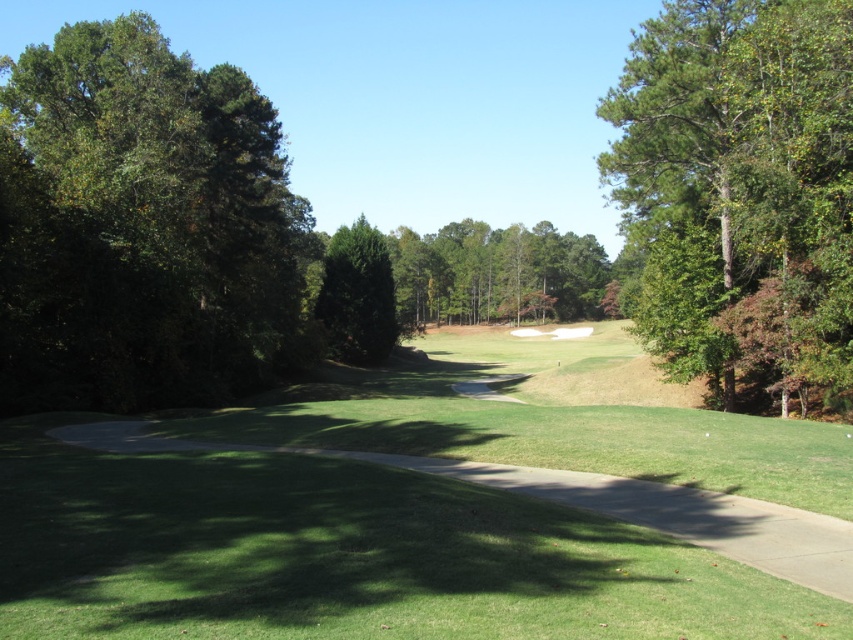
Question: Which point is closer to the camera taking this photo?

Choices:
 (A) (656, 292)
 (B) (279, 246)

Answer: (A)

Question: Is green grassy golf course at center positioned in front of green leafy tree at upper right?

Choices:
 (A) no
 (B) yes

Answer: (B)

Question: Is green grassy golf course at center in front of green leafy tree at upper right?

Choices:
 (A) no
 (B) yes

Answer: (B)

Question: Which point is closer to the camera?

Choices:
 (A) (378, 509)
 (B) (331, 301)
 (C) (202, 196)
 (D) (630, 81)

Answer: (A)

Question: Among these points, which one is farthest from the camera?

Choices:
 (A) (332, 307)
 (B) (264, 248)
 (C) (798, 248)
 (D) (463, 595)

Answer: (A)

Question: Does green leafy tree at left have a larger size compared to green leafy tree at upper right?

Choices:
 (A) yes
 (B) no

Answer: (A)